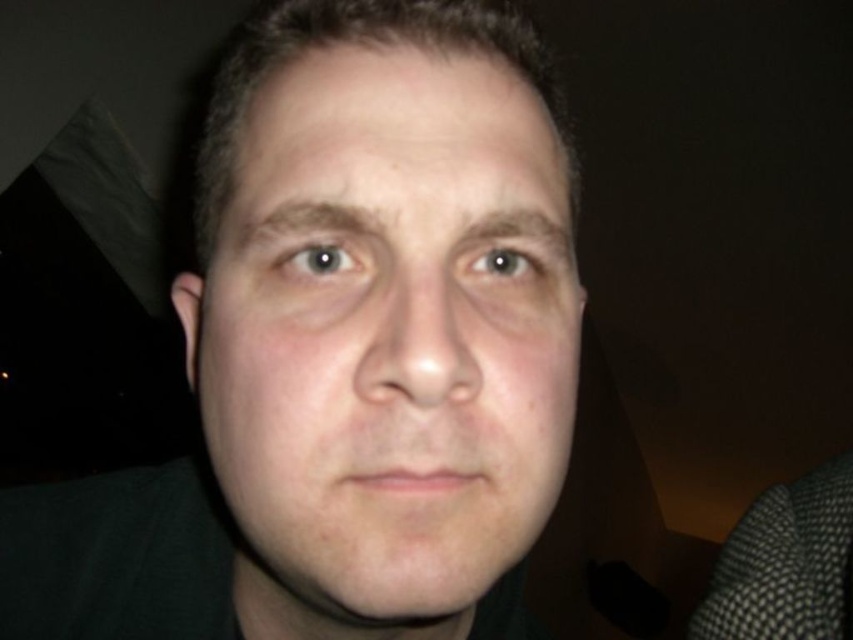
Question: Does blue glossy eye at upper left have a lesser width compared to light brown eye at center?

Choices:
 (A) no
 (B) yes

Answer: (A)

Question: Which point is closer to the camera?

Choices:
 (A) (238, 598)
 (B) (517, 275)
 (C) (338, 264)

Answer: (C)

Question: Can you confirm if smooth skin face at center is positioned to the right of light brown eye at center?

Choices:
 (A) no
 (B) yes

Answer: (A)

Question: Which object appears farthest from the camera in this image?

Choices:
 (A) smooth skin face at center
 (B) light brown eye at center

Answer: (B)

Question: Which of the following is the closest to the observer?

Choices:
 (A) blue glossy eye at upper left
 (B) smooth skin face at center

Answer: (B)

Question: Is blue glossy eye at upper left thinner than light brown eye at center?

Choices:
 (A) yes
 (B) no

Answer: (B)